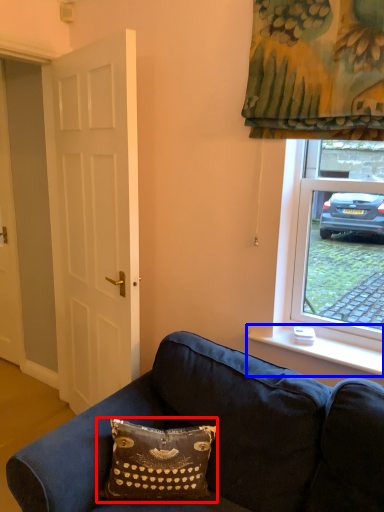
Question: Which object is closer to the camera taking this photo, pillow (highlighted by a red box) or window sill (highlighted by a blue box)?

Choices:
 (A) pillow
 (B) window sill

Answer: (A)